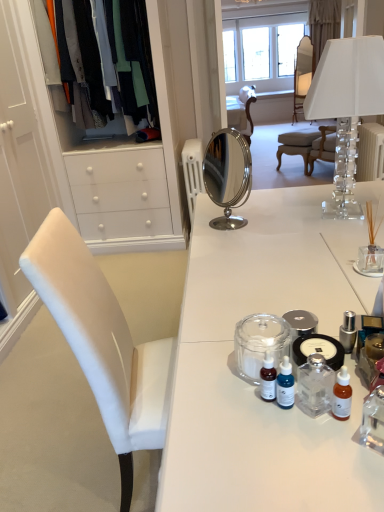
Question: Is clear glass bottle at center oriented away from clear crystal lampshade at upper right?

Choices:
 (A) yes
 (B) no

Answer: (B)

Question: Is clear glass bottle at center further to the viewer compared to clear crystal lampshade at upper right?

Choices:
 (A) no
 (B) yes

Answer: (A)

Question: Can you confirm if clear glass bottle at center is taller than clear crystal lampshade at upper right?

Choices:
 (A) yes
 (B) no

Answer: (B)

Question: From a real-world perspective, does clear glass bottle at center stand above clear crystal lampshade at upper right?

Choices:
 (A) no
 (B) yes

Answer: (A)

Question: Does clear glass bottle at center have a lesser width compared to clear crystal lampshade at upper right?

Choices:
 (A) no
 (B) yes

Answer: (B)

Question: From the image's perspective, is clear glass bottle at center located beneath clear crystal lampshade at upper right?

Choices:
 (A) no
 (B) yes

Answer: (B)

Question: Considering the relative sizes of matte white chair at center, the second chair in the left-to-right sequence, and blue glass dropper bottle at center, arranged as the first toiletry when viewed from the left, in the image provided, is matte white chair at center, the second chair in the left-to-right sequence, shorter than blue glass dropper bottle at center, arranged as the first toiletry when viewed from the left,?

Choices:
 (A) no
 (B) yes

Answer: (A)

Question: Can you confirm if matte white chair at center, the 1th chair from the top, is thinner than blue glass dropper bottle at center, which is the 1th toiletry in front-to-back order?

Choices:
 (A) yes
 (B) no

Answer: (B)

Question: Does matte white chair at center, which appears as the first chair when viewed from the back, appear on the right side of blue glass dropper bottle at center, the 2th toiletry when ordered from back to front?

Choices:
 (A) no
 (B) yes

Answer: (B)

Question: Is blue glass dropper bottle at center, which ranks as the second toiletry in right-to-left order, at the back of matte white chair at center, which is the 1th chair in right-to-left order?

Choices:
 (A) no
 (B) yes

Answer: (A)

Question: Considering the relative sizes of matte white chair at center, which is the 2th chair in front-to-back order, and blue glass dropper bottle at center, the 2th toiletry when ordered from back to front, in the image provided, is matte white chair at center, which is the 2th chair in front-to-back order, bigger than blue glass dropper bottle at center, the 2th toiletry when ordered from back to front,?

Choices:
 (A) no
 (B) yes

Answer: (B)

Question: From a real-world perspective, does matte white chair at center, which appears as the first chair when viewed from the back, sit lower than blue glass dropper bottle at center, which is the 1th toiletry in front-to-back order?

Choices:
 (A) yes
 (B) no

Answer: (A)

Question: Is transparent glass jar at center positioned beyond the bounds of silky cotton shirts at upper left?

Choices:
 (A) yes
 (B) no

Answer: (A)